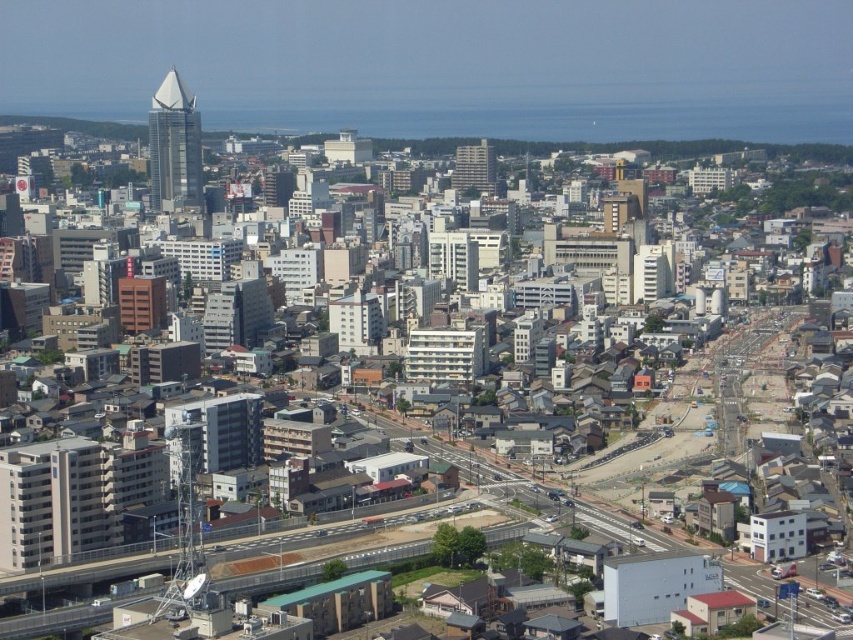
You are a city planner analyzing the urban layout. Given the presence of the shiny glass skyscraper at upper left and the matte glass spire at upper left, which of these two structures has a greater horizontal spread in terms of their base footprint?

The shiny glass skyscraper at upper left has a larger width than the matte glass spire at upper left, indicating it has a greater horizontal spread in terms of their base footprint.

You are a drone operator flying a drone that can only ascend up to 100 meters. You need to capture a photo of both the shiny glass skyscraper at upper left and the matte glass spire at upper left. Given their positions relative to you, can your drone safely take the photo without exceeding its maximum altitude?

The shiny glass skyscraper at upper left is closer to the viewer than the matte glass spire at upper left. Since the drone can ascend up to 100 meters, it can capture both structures within this altitude as the closer skyscraper requires less elevation and the spire, being farther, would still be within the drone

You are a drone operator trying to navigate between two buildings in the city. You see the shiny glass skyscraper at upper left and the matte glass spire at upper left. Which building is located to the right when looking at the city skyline from this aerial view?

The shiny glass skyscraper at upper left is positioned on the right side of matte glass spire at upper left, so when looking at the city skyline from the aerial view, the shiny glass skyscraper at upper left is to the right of the matte glass spire at upper left.